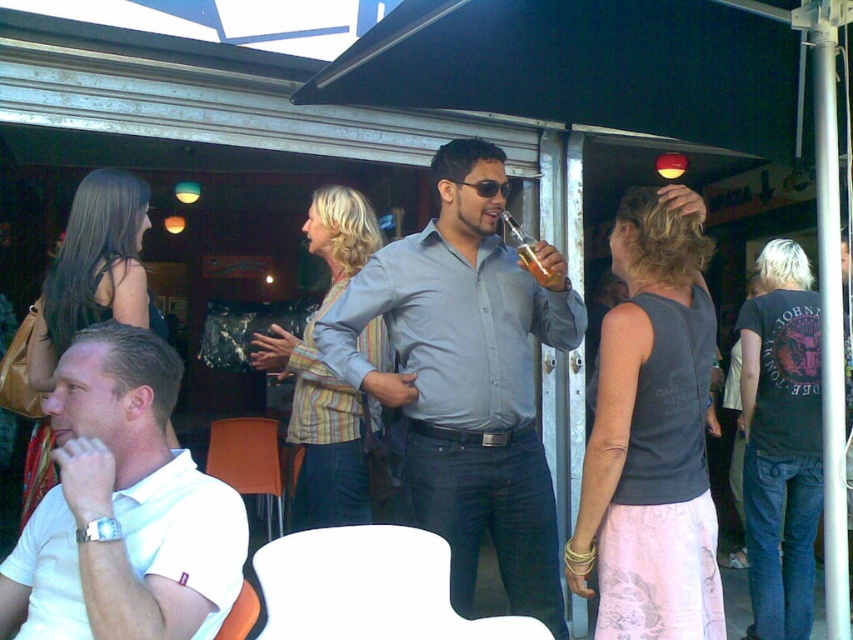
Question: Is striped fabric jacket at center to the right of matte black dress at left from the viewer's perspective?

Choices:
 (A) yes
 (B) no

Answer: (A)

Question: Is white matte polo shirt at left further to the viewer compared to dark gray sleeveless top at center?

Choices:
 (A) yes
 (B) no

Answer: (B)

Question: Estimate the real-world distances between objects in this image. Which object is farther from the white matte polo shirt at left?

Choices:
 (A) black cotton t-shirt at right
 (B) matte gray shirt at center

Answer: (A)

Question: Which of the following is the closest to the observer?

Choices:
 (A) (653, 368)
 (B) (347, 404)
 (C) (132, 182)

Answer: (A)

Question: Is matte gray shirt at center to the left of dark gray sleeveless top at center from the viewer's perspective?

Choices:
 (A) yes
 (B) no

Answer: (A)

Question: Which point appears closest to the camera in this image?

Choices:
 (A) (80, 324)
 (B) (619, 492)
 (C) (368, 428)
 (D) (461, 499)

Answer: (B)